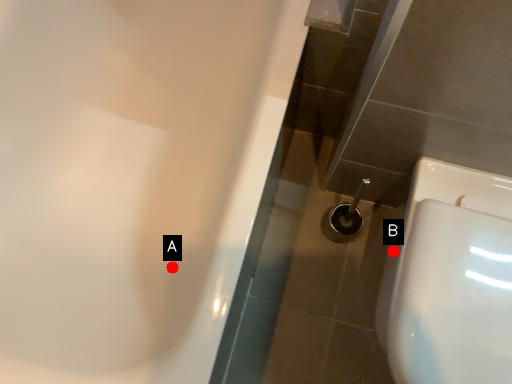
Question: Two points are circled on the image, labeled by A and B beside each circle. Which point is farther to the camera?

Choices:
 (A) A is further
 (B) B is further

Answer: (A)